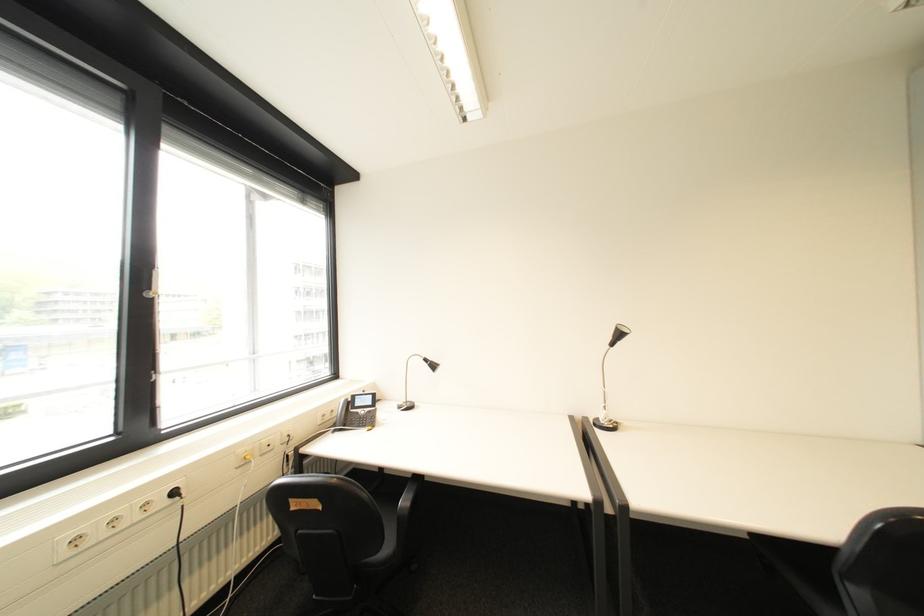
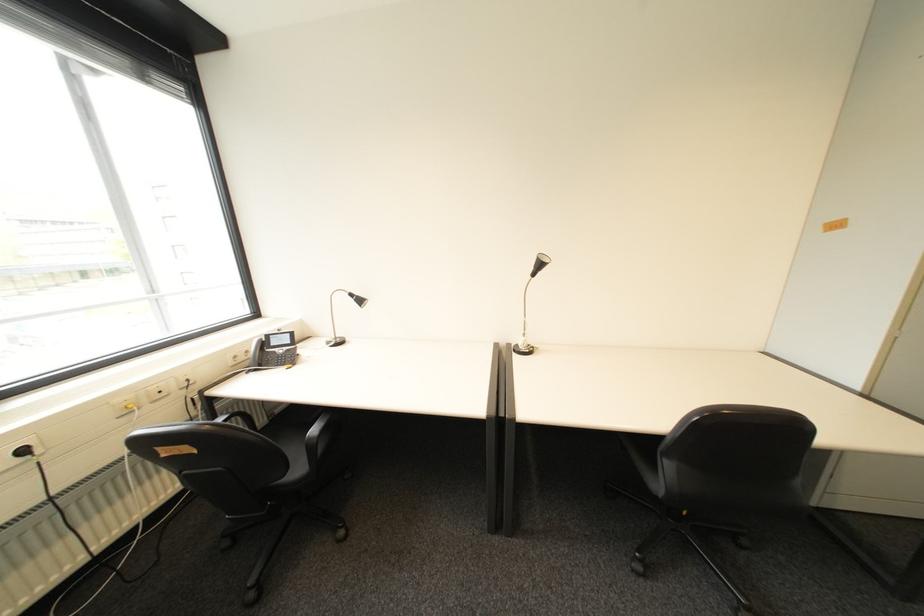
Locate, in the second image, the point that corresponds to the point at 367,406 in the first image.

(283, 345)